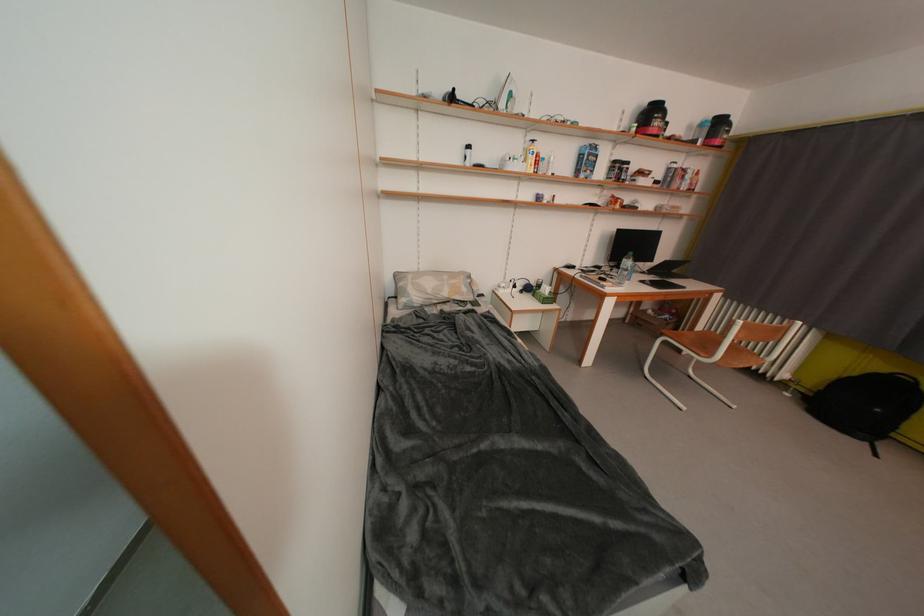
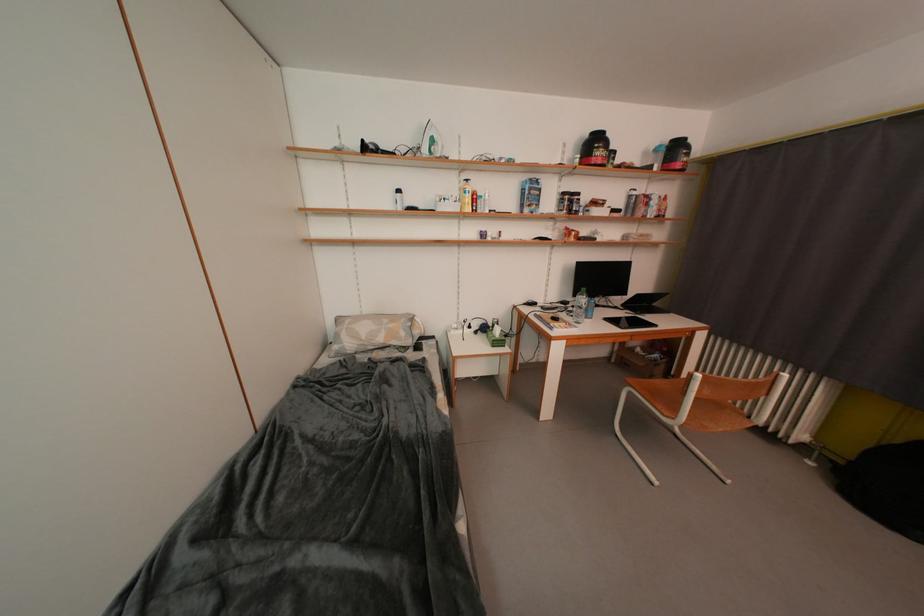
Question: Which direction would the cameraman need to move to produce the second image? Reply with the corresponding letter.

Choices:
 (A) Left
 (B) Right
 (C) Forward
 (D) Backward

Answer: (B)